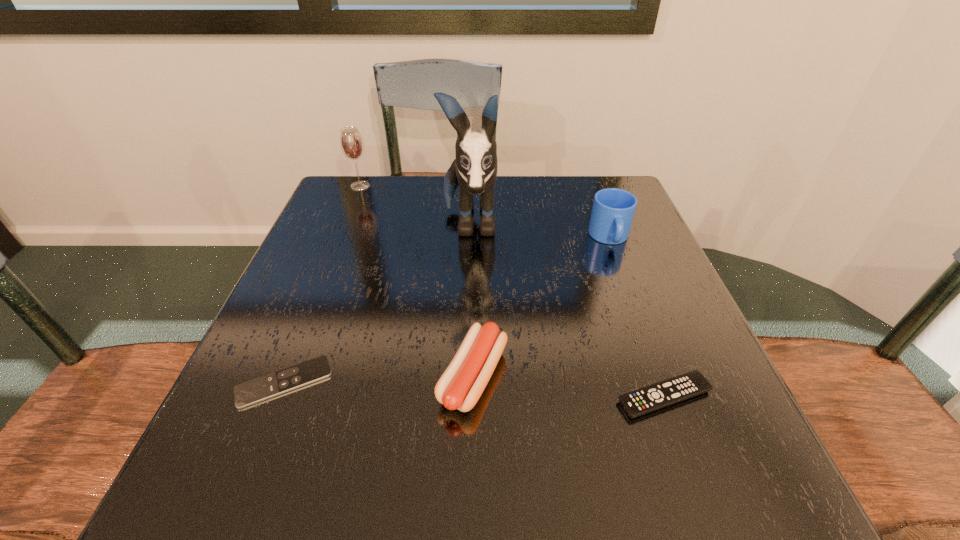
At what (x,y) coordinates should I click in order to perform the action: click on free space located on the front of the farthest object. Please return your answer as a coordinate pair (x, y). The height and width of the screenshot is (540, 960). Looking at the image, I should click on (341, 233).

Identify the location of vacant space located 0.080m on the side of the third tallest object with the handle. The height and width of the screenshot is (540, 960). [x=625, y=278].

The height and width of the screenshot is (540, 960). Find the location of `vacant space located on the back of the sausage`. vacant space located on the back of the sausage is located at coordinates (475, 252).

You are a GUI agent. You are given a task and a screenshot of the screen. Output one action in this format:
    pyautogui.click(x=<x>, y=<y>)
    Task: Click on the vacant space located on the back of the taller remote control
    
    Given the screenshot: What is the action you would take?
    pyautogui.click(x=611, y=249)

Find the location of `free space located on the right of the shorter remote control`. free space located on the right of the shorter remote control is located at coordinates (483, 382).

Locate an element on the screen. The height and width of the screenshot is (540, 960). puppy that is at the far edge is located at coordinates (475, 168).

Where is `wineglass situated at the far edge`? This screenshot has width=960, height=540. wineglass situated at the far edge is located at coordinates [352, 146].

What are the coordinates of `mug that is at the far edge` in the screenshot? It's located at (613, 209).

The width and height of the screenshot is (960, 540). I want to click on wineglass present at the left edge, so click(352, 146).

Image resolution: width=960 pixels, height=540 pixels. In order to click on remote control located at the left edge in this screenshot , I will do `click(256, 390)`.